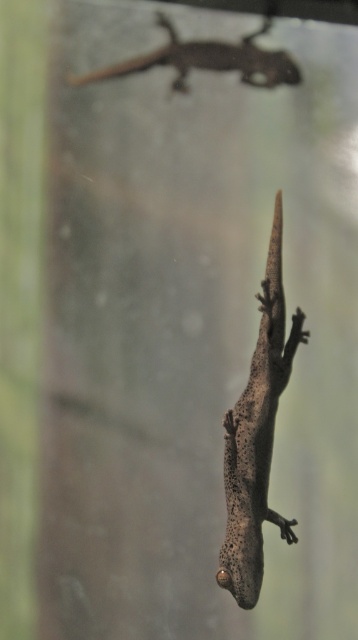
Question: Is speckled gray lizard at center closer to the viewer compared to smooth brown lizard at upper center?

Choices:
 (A) yes
 (B) no

Answer: (A)

Question: Does speckled gray lizard at center appear on the right side of smooth brown lizard at upper center?

Choices:
 (A) no
 (B) yes

Answer: (B)

Question: Which object is closer to the camera taking this photo?

Choices:
 (A) speckled gray lizard at center
 (B) smooth brown lizard at upper center

Answer: (A)

Question: Which point is farther to the camera?

Choices:
 (A) (257, 582)
 (B) (215, 52)

Answer: (B)

Question: Does speckled gray lizard at center have a lesser width compared to smooth brown lizard at upper center?

Choices:
 (A) no
 (B) yes

Answer: (B)

Question: Which object appears farthest from the camera in this image?

Choices:
 (A) smooth brown lizard at upper center
 (B) speckled gray lizard at center

Answer: (A)